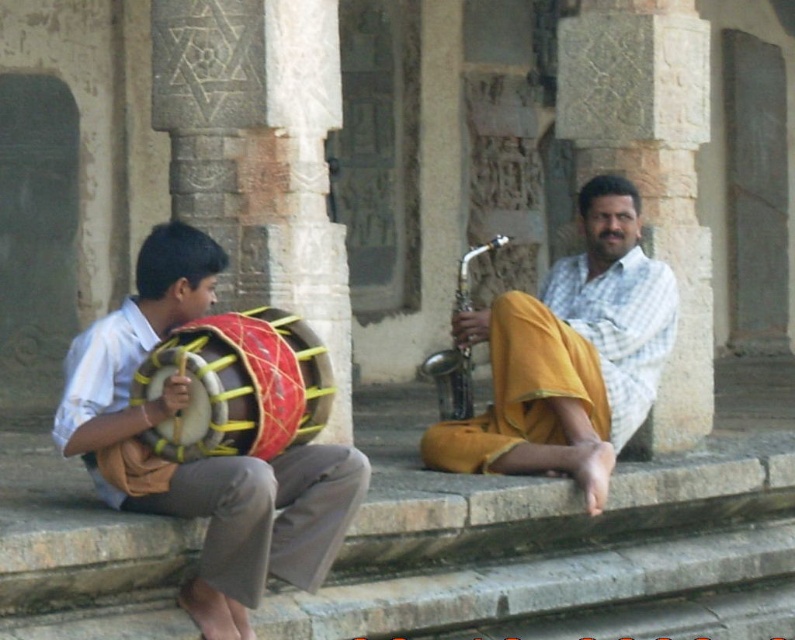
Question: Which point is closer to the camera?

Choices:
 (A) (167, 262)
 (B) (518, 358)

Answer: (A)

Question: Considering the relative positions of yellow cotton pants at center and red leather drum at left in the image provided, where is yellow cotton pants at center located with respect to red leather drum at left?

Choices:
 (A) left
 (B) right

Answer: (B)

Question: Is matte red drum at left closer to camera compared to red leather drum at left?

Choices:
 (A) yes
 (B) no

Answer: (B)

Question: Which point is farther to the camera?

Choices:
 (A) (220, 353)
 (B) (64, 432)

Answer: (B)

Question: Is matte red drum at left positioned at the back of red leather drum at left?

Choices:
 (A) no
 (B) yes

Answer: (B)

Question: Which of the following is the closest to the observer?

Choices:
 (A) (565, 364)
 (B) (303, 326)

Answer: (B)